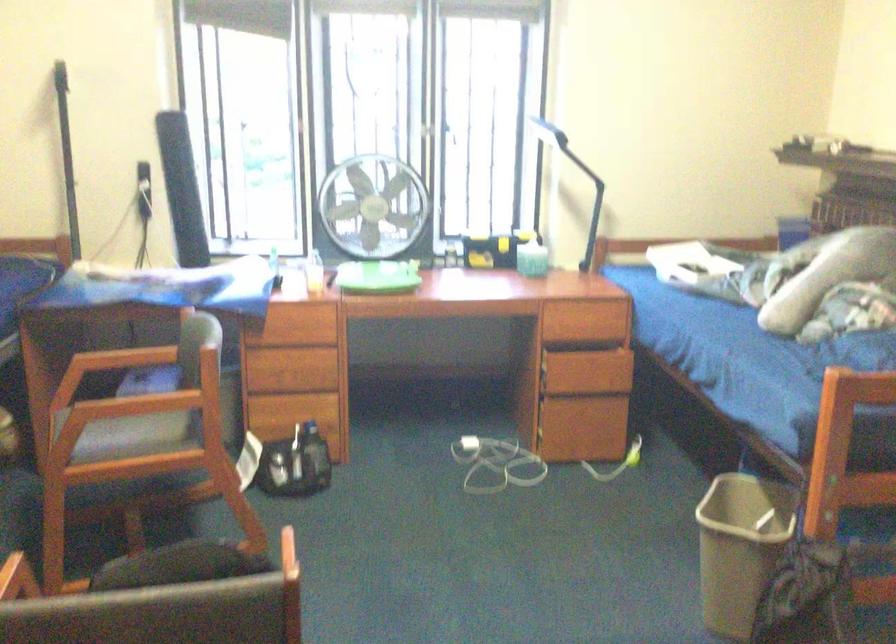
Image resolution: width=896 pixels, height=644 pixels. What do you see at coordinates (128, 357) in the screenshot? I see `a wooden chair armrest` at bounding box center [128, 357].